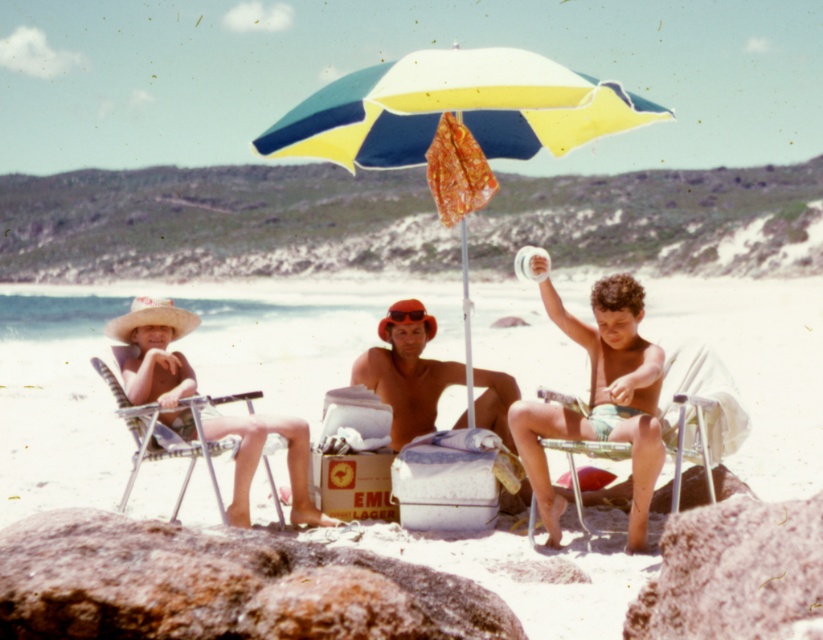
You are planning to set up a small picnic on the white sand beach at center and the metallic silver beach chair at right. Which location would provide more space for your picnic setup?

The white sand beach at center is larger in size than the metallic silver beach chair at right, so it would provide more space for your picnic setup.